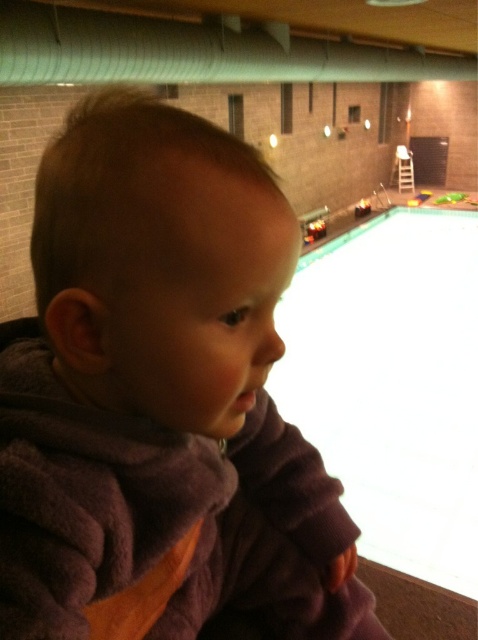
You are standing at the position of the child in the image and want to reach the point marked as point (98, 358). Which direction should you move relative to the point marked as point (421, 243)?

You should move forward relative to point (421, 243) because point (98, 358) is in front of it.

You are a lifeguard in the pool area. You see the purple fleece toddler at center and the white smooth water at center. Which object is located to the right of the other?

The white smooth water at center is located to the right of the purple fleece toddler at center because the purple fleece toddler at center is positioned on the left side of white smooth water at center.

You are a photographer standing in front of the purple fleece toddler at center. You want to take a clear photo of them without any blur. Considering the toddler is only 11.32 inches away, what adjustment should you make to your camera settings?

Since the purple fleece toddler at center is only 11.32 inches away, you should adjust the camera focus to a close range or use a macro setting to ensure the photo is clear and not blurry.